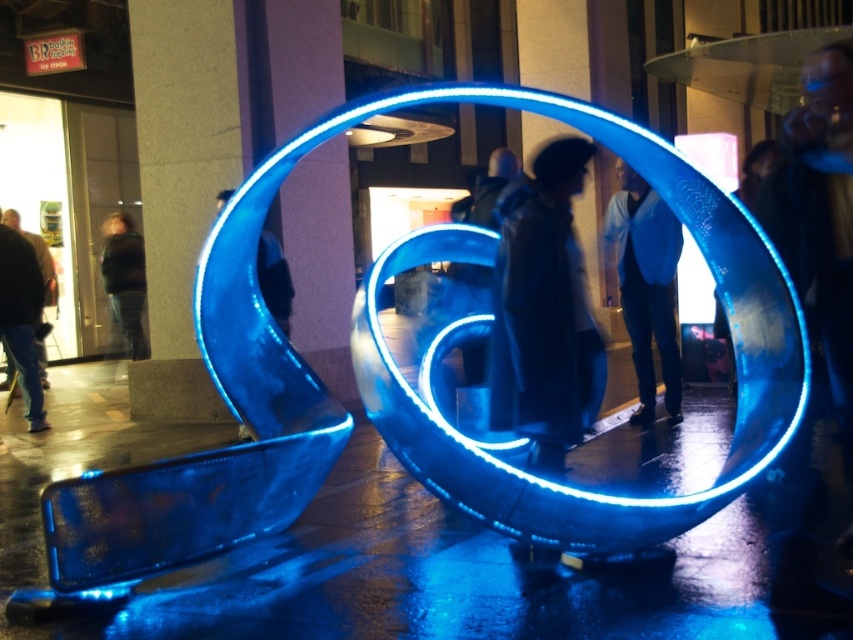
Question: Which object is farther from the camera taking this photo?

Choices:
 (A) dark blue jeans at left
 (B) blue glossy jacket at center
 (C) dark gray hoodie at center

Answer: (A)

Question: Observing the image, what is the correct spatial positioning of dark blue jeans at left in reference to dark green jacket at left?

Choices:
 (A) left
 (B) right

Answer: (B)

Question: Which is farther from the dark green jacket at left?

Choices:
 (A) dark gray hoodie at center
 (B) blue glossy jacket at center

Answer: (A)

Question: Does blue glossy jacket at center have a greater width compared to dark blue jeans at left?

Choices:
 (A) yes
 (B) no

Answer: (A)

Question: Estimate the real-world distances between objects in this image. Which object is closer to the blue glossy jacket at center?

Choices:
 (A) shiny blue ring at center
 (B) dark gray hoodie at center

Answer: (A)

Question: Is the position of dark gray hoodie at center more distant than that of dark blue jeans at left?

Choices:
 (A) no
 (B) yes

Answer: (A)